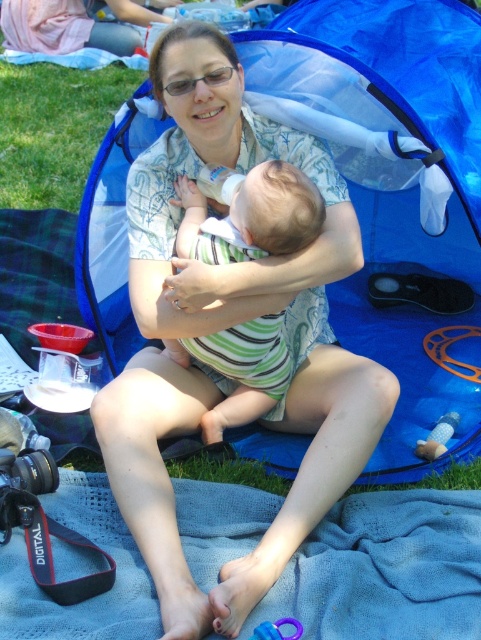
Does blue fabric blanket at lower center have a greater height compared to green striped onesie at center?

No.

Describe the element at coordinates (385, 570) in the screenshot. The image size is (481, 640). I see `blue fabric blanket at lower center` at that location.

At what (x,y) coordinates should I click in order to perform the action: click on blue fabric blanket at lower center. Please return your answer as a coordinate pair (x, y). Looking at the image, I should click on (385, 570).

Is matte white shirt at center positioned in front of green striped onesie at center?

Yes, it is in front of green striped onesie at center.

Is point (291, 321) positioned behind point (187, 179)?

Yes, it is behind point (187, 179).

The width and height of the screenshot is (481, 640). In order to click on matte white shirt at center in this screenshot , I will do `click(225, 326)`.

Does matte white shirt at center lie in front of blue fabric blanket at lower center?

No, matte white shirt at center is further to the viewer.

Is matte white shirt at center bigger than blue fabric blanket at lower center?

Correct, matte white shirt at center is larger in size than blue fabric blanket at lower center.

Find the location of a particular element. The height and width of the screenshot is (640, 481). matte white shirt at center is located at coordinates (225, 326).